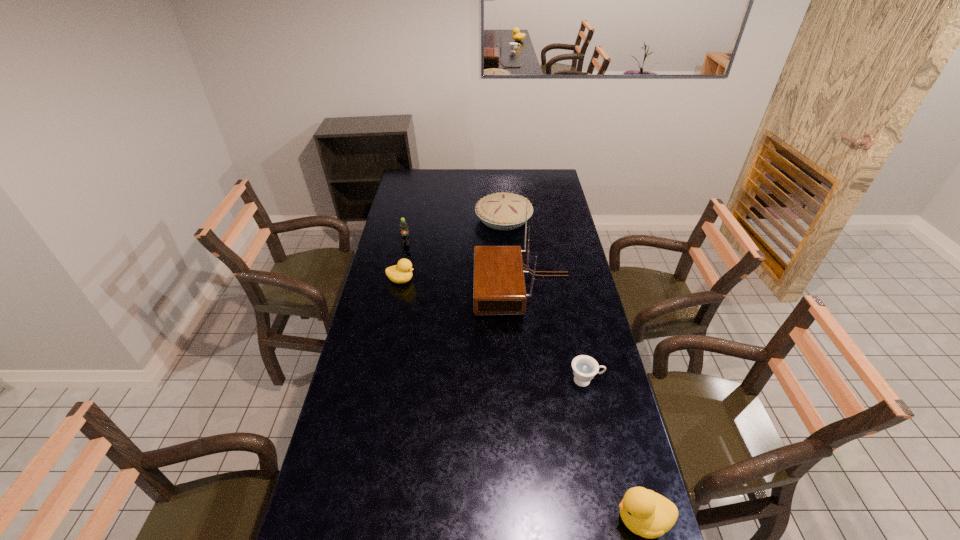
Where is `vacant area at the right edge`? vacant area at the right edge is located at coordinates (581, 338).

I want to click on free space at the far left corner of the desktop, so click(408, 179).

Where is `free point between the fifth nearest object and the farthest object`? Image resolution: width=960 pixels, height=540 pixels. free point between the fifth nearest object and the farthest object is located at coordinates (455, 232).

The image size is (960, 540). What are the coordinates of `empty space between the farther duck and the farthest object` in the screenshot? It's located at (452, 249).

Locate an element on the screen. free space between the radio_receiver and the left duck is located at coordinates (462, 284).

Where is `free spot between the farther duck and the radio_receiver`? The height and width of the screenshot is (540, 960). free spot between the farther duck and the radio_receiver is located at coordinates (462, 284).

In order to click on object that stands as the fifth closest to the right duck in this screenshot , I will do `click(404, 233)`.

Where is `object that is the fifth nearest to the nearest object`? This screenshot has width=960, height=540. object that is the fifth nearest to the nearest object is located at coordinates (404, 233).